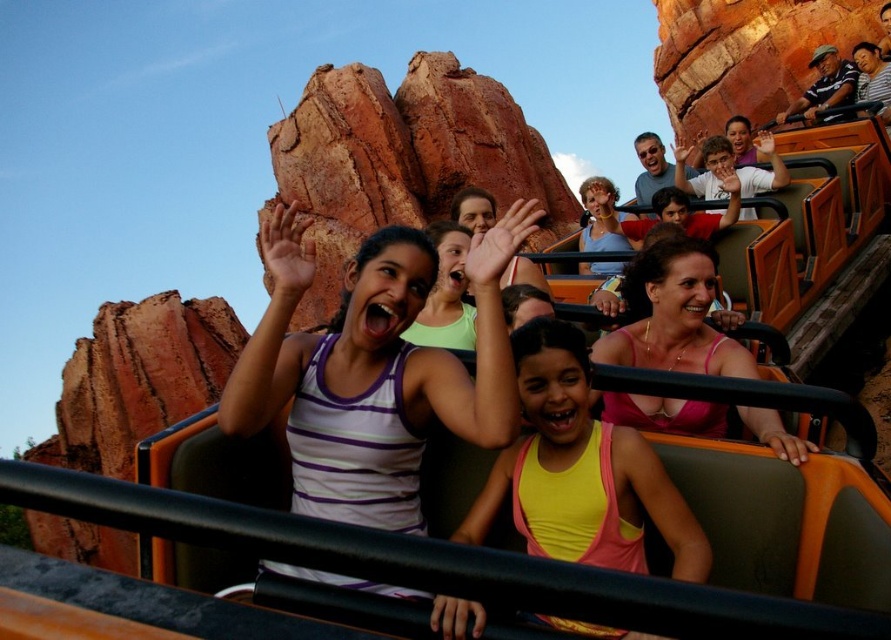
You are designing a new amusement park ride and want to ensure that all passengers can comfortably reach the safety bars. The safety bars are 1.2 meters above the seat. Given that the white striped tank top at center and the yellow matte tank top at center are worn by two children sitting next to each other, which child might need a taller safety bar?

The white striped tank top at center has a larger size compared to the yellow matte tank top at center, so the child wearing the white striped tank top at center is likely taller and may need a taller safety bar to comfortably reach it.